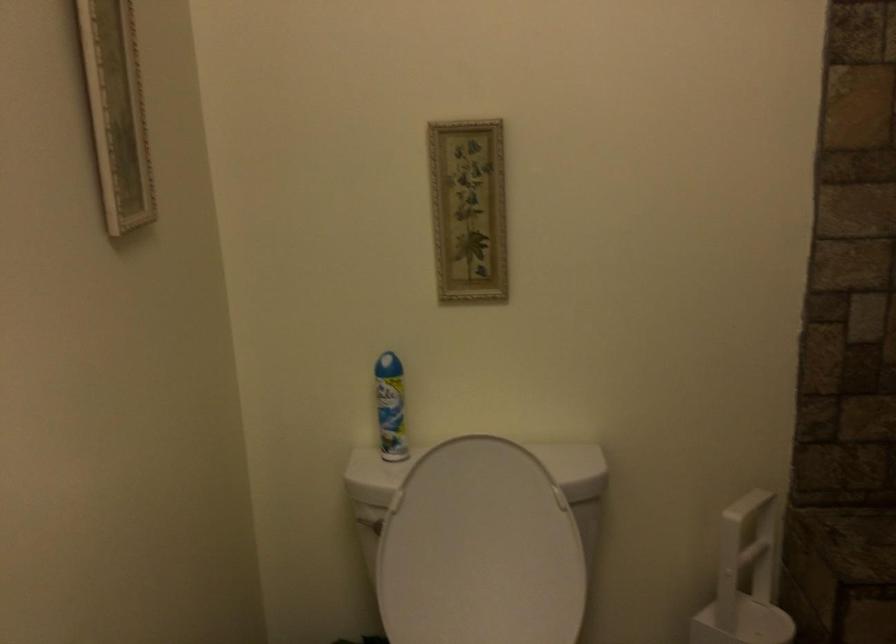
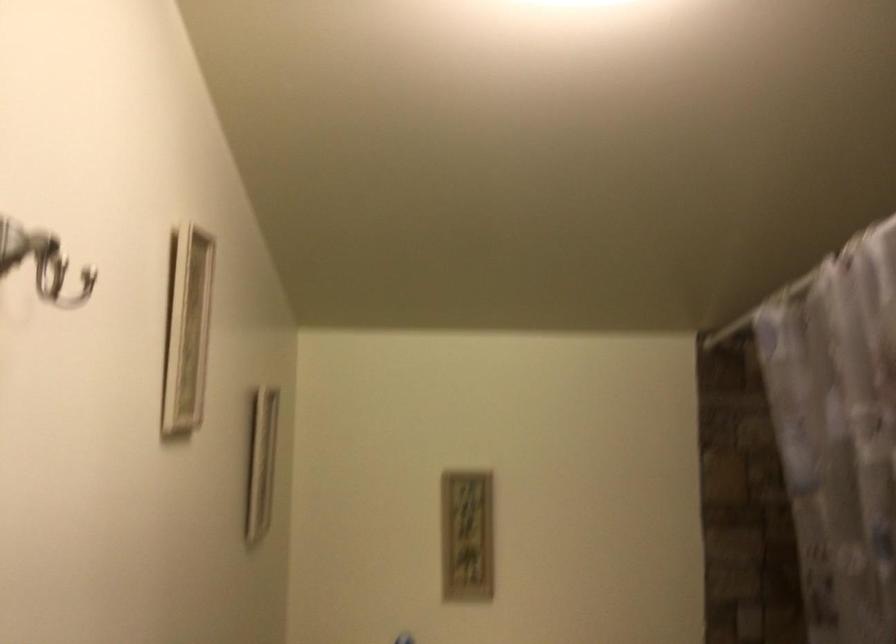
Question: Which direction would the cameraman need to move to produce the second image? Reply with the corresponding letter.

Choices:
 (A) Left
 (B) Right
 (C) Forward
 (D) Backward

Answer: (D)